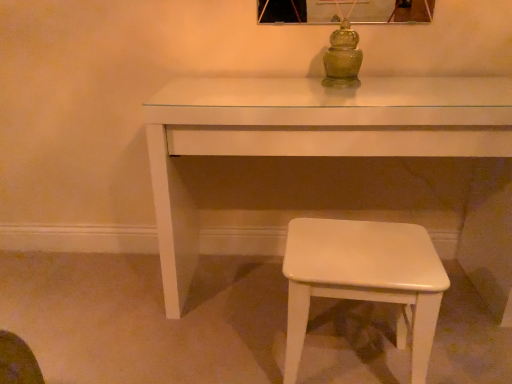
Identify the location of white glossy stool at lower right. The height and width of the screenshot is (384, 512). (364, 279).

Describe the element at coordinates (343, 55) in the screenshot. This screenshot has height=384, width=512. I see `green glass jar at center` at that location.

At what (x,y) coordinates should I click in order to perform the action: click on white glossy stool at lower right. Please return your answer as a coordinate pair (x, y). Looking at the image, I should click on [364, 279].

From the image's perspective, is white glossy table at center over green glass jar at center?

No, from the image's perspective, white glossy table at center is not above green glass jar at center.

Considering the points (485, 81) and (358, 69), which point is in front, point (485, 81) or point (358, 69)?

The point (485, 81) is more forward.

Is white glossy table at center aimed at green glass jar at center?

No, white glossy table at center is not oriented towards green glass jar at center.

From the picture: Measure the distance between white glossy table at center and green glass jar at center.

The distance of white glossy table at center from green glass jar at center is 32.86 centimeters.

Which is in front, white glossy stool at lower right or green glass jar at center?

white glossy stool at lower right.

Find the location of a particular element. The height and width of the screenshot is (384, 512). table lamp on the left of white glossy stool at lower right is located at coordinates (343, 55).

Which object is thinner, white glossy table at center or white glossy stool at lower right?

Thinner between the two is white glossy stool at lower right.

Locate an element on the screen. stool that is below the white glossy table at center (from the image's perspective) is located at coordinates (364, 279).

Considering the positions of objects white glossy table at center and white glossy stool at lower right in the image provided, who is more to the right, white glossy table at center or white glossy stool at lower right?

white glossy stool at lower right is more to the right.

Which of these two, white glossy table at center or white glossy stool at lower right, stands shorter?

white glossy stool at lower right is shorter.

Is white glossy stool at lower right to the left of white glossy table at center from the viewer's perspective?

No.

Considering the points (338, 235) and (183, 194), which point is behind, point (338, 235) or point (183, 194)?

Positioned behind is point (183, 194).

Locate an element on the screen. stool located below the white glossy table at center (from the image's perspective) is located at coordinates point(364,279).

Does green glass jar at center touch white glossy stool at lower right?

No, green glass jar at center is not touching white glossy stool at lower right.

Is the depth of green glass jar at center less than that of white glossy stool at lower right?

No.

From the image's perspective, which is above, green glass jar at center or white glossy stool at lower right?

green glass jar at center is shown above in the image.

What's the angular difference between green glass jar at center and white glossy stool at lower right's facing directions?

The angular difference between green glass jar at center and white glossy stool at lower right is 2.21 degrees.

What's the angular difference between green glass jar at center and white glossy table at center's facing directions?

There is a 2.03-degree angle between the facing directions of green glass jar at center and white glossy table at center.

Between green glass jar at center and white glossy table at center, which one is positioned in front?

white glossy table at center is more forward.

Is white glossy table at center completely or partially inside green glass jar at center?

No.

What are the coordinates of `table lamp above the white glossy table at center (from a real-world perspective)` in the screenshot? It's located at (343, 55).

Image resolution: width=512 pixels, height=384 pixels. Find the location of `stool below the green glass jar at center (from a real-world perspective)`. stool below the green glass jar at center (from a real-world perspective) is located at coordinates (364, 279).

Considering their positions, is green glass jar at center positioned closer to white glossy table at center than white glossy stool at lower right?

Among the two, green glass jar at center is located nearer to white glossy table at center.

Looking at the image, which one is located closer to white glossy stool at lower right, white glossy table at center or green glass jar at center?

white glossy table at center lies closer to white glossy stool at lower right than the other object.

Based on the photo, which object lies further to the anchor point white glossy table at center, white glossy stool at lower right or green glass jar at center?

Based on the image, white glossy stool at lower right appears to be further to white glossy table at center.

Based on the photo, which object lies nearer to the anchor point white glossy stool at lower right, green glass jar at center or white glossy table at center?

The object closer to white glossy stool at lower right is white glossy table at center.

Which object lies nearer to the anchor point green glass jar at center, white glossy stool at lower right or white glossy table at center?

Among the two, white glossy table at center is located nearer to green glass jar at center.

Which object lies further to the anchor point green glass jar at center, white glossy table at center or white glossy stool at lower right?

Based on the image, white glossy stool at lower right appears to be further to green glass jar at center.

Locate an element on the screen. The image size is (512, 384). table that lies between green glass jar at center and white glossy stool at lower right from top to bottom is located at coordinates (307, 136).